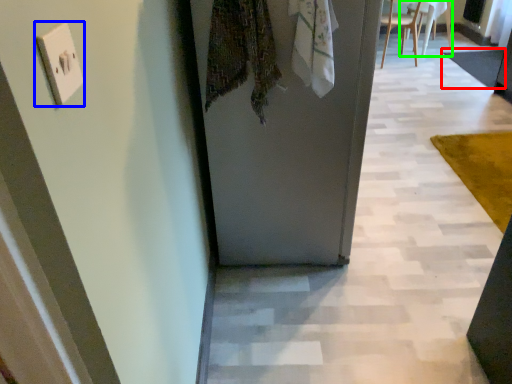
Question: Based on their relative distances, which object is nearer to mat (highlighted by a red box)? Choose from electric outlet (highlighted by a blue box) and chair (highlighted by a green box).

Choices:
 (A) electric outlet
 (B) chair

Answer: (B)